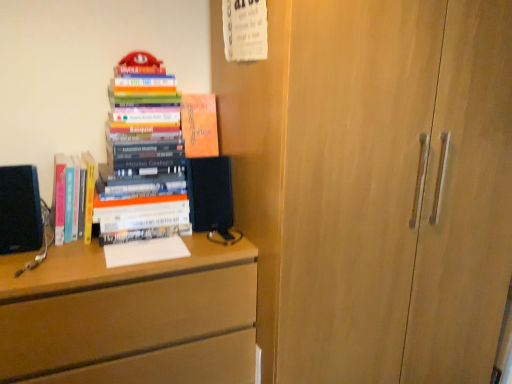
You are a GUI agent. You are given a task and a screenshot of the screen. Output one action in this format:
    pyautogui.click(x=<x>, y=<y>)
    Task: Click on the free space in front of black matte speaker at center
    
    Given the screenshot: What is the action you would take?
    pyautogui.click(x=210, y=236)